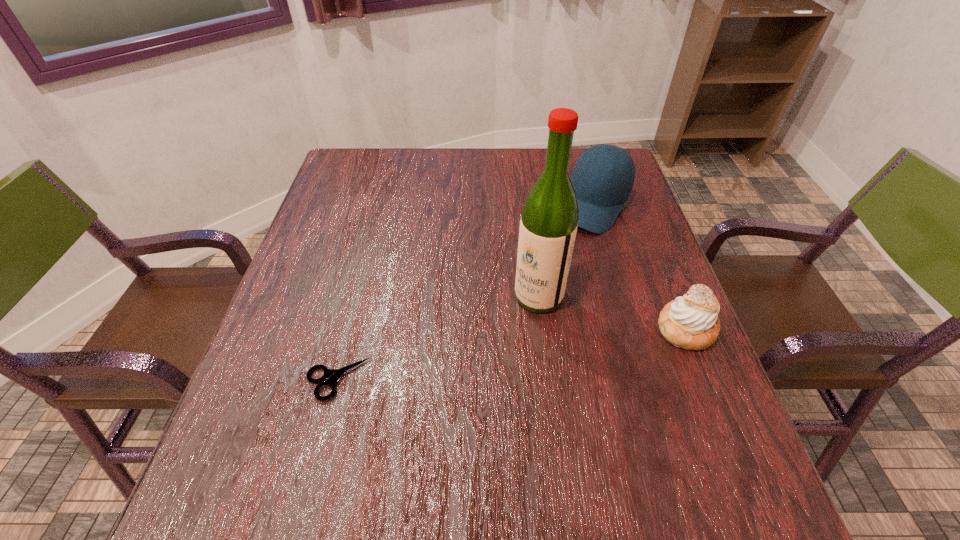
The image size is (960, 540). Identify the location of free spot on the desktop that is between the leftmost object and the pastry and is positioned on the front-facing side of the second tallest object. (494, 356).

You are a GUI agent. You are given a task and a screenshot of the screen. Output one action in this format:
    pyautogui.click(x=<x>, y=<y>)
    Task: Click on the vacant spot on the desktop that is between the shears and the pastry and is positioned on the label of the second object from left to right
    The image size is (960, 540).
    Given the screenshot: What is the action you would take?
    pyautogui.click(x=472, y=360)